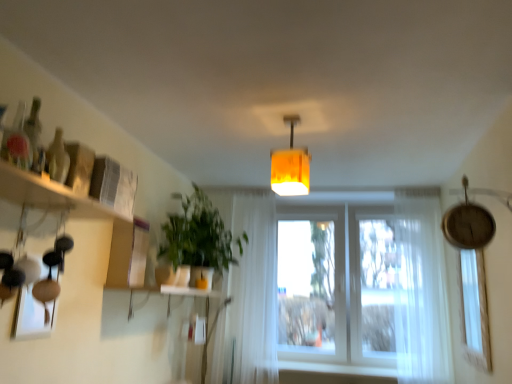
Question: Is transparent glass window at right with white sheer curtain at right, the second curtain from the left?

Choices:
 (A) yes
 (B) no

Answer: (B)

Question: Does transparent glass window at right have a larger size compared to white sheer curtain at right, the second curtain from the left?

Choices:
 (A) yes
 (B) no

Answer: (B)

Question: From the image's perspective, is transparent glass window at right over white sheer curtain at right, the 1th curtain when ordered from right to left?

Choices:
 (A) no
 (B) yes

Answer: (B)

Question: Is transparent glass window at right positioned beyond the bounds of white sheer curtain at right, the 1th curtain when ordered from right to left?

Choices:
 (A) no
 (B) yes

Answer: (B)

Question: Is transparent glass window at right further to the viewer compared to white sheer curtain at right, the second curtain from the left?

Choices:
 (A) no
 (B) yes

Answer: (A)

Question: Considering the relative sizes of transparent glass window at right and white sheer curtain at right, the 1th curtain when ordered from right to left, in the image provided, is transparent glass window at right shorter than white sheer curtain at right, the 1th curtain when ordered from right to left,?

Choices:
 (A) yes
 (B) no

Answer: (A)

Question: Considering the relative sizes of green matte plant at center-left and white matte window sill at lower center in the image provided, is green matte plant at center-left wider than white matte window sill at lower center?

Choices:
 (A) yes
 (B) no

Answer: (A)

Question: Is green matte plant at center-left closer to camera compared to white matte window sill at lower center?

Choices:
 (A) yes
 (B) no

Answer: (A)

Question: From a real-world perspective, is green matte plant at center-left below white matte window sill at lower center?

Choices:
 (A) no
 (B) yes

Answer: (A)

Question: Is green matte plant at center-left at the right side of white matte window sill at lower center?

Choices:
 (A) yes
 (B) no

Answer: (B)

Question: Considering the relative sizes of green matte plant at center-left and white matte window sill at lower center in the image provided, is green matte plant at center-left thinner than white matte window sill at lower center?

Choices:
 (A) no
 (B) yes

Answer: (A)

Question: From a real-world perspective, does green matte plant at center-left stand above white matte window sill at lower center?

Choices:
 (A) yes
 (B) no

Answer: (A)

Question: Is white sheer curtain at right, the 1th curtain when ordered from right to left, at the back of translucent glass bottle at upper left?

Choices:
 (A) yes
 (B) no

Answer: (B)